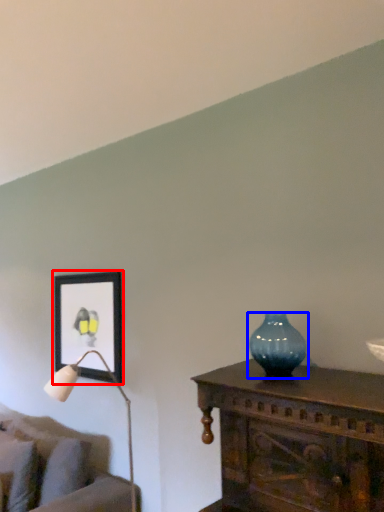
Question: Which of the following is the farthest to the observer, picture frame (highlighted by a red box) or vase (highlighted by a blue box)?

Choices:
 (A) picture frame
 (B) vase

Answer: (A)